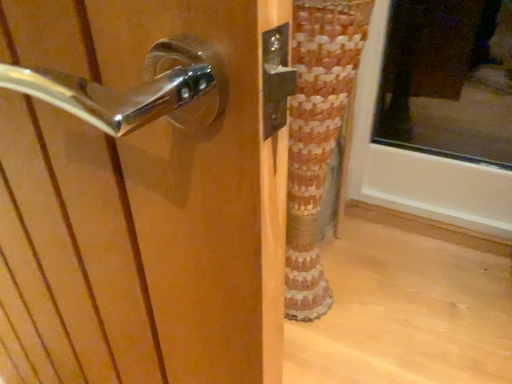
What do you see at coordinates (144, 189) in the screenshot?
I see `polished metal handle at center` at bounding box center [144, 189].

This screenshot has height=384, width=512. What are the coordinates of `polished metal handle at center` in the screenshot? It's located at (144, 189).

This screenshot has width=512, height=384. In order to click on polished metal handle at center in this screenshot , I will do `click(144, 189)`.